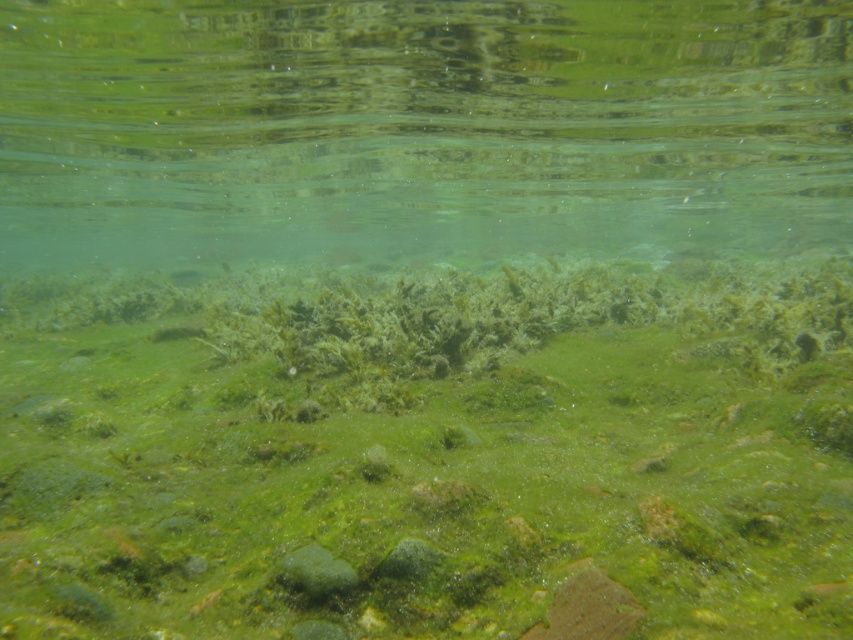
Question: Does green algae at center have a larger size compared to green translucent water at center?

Choices:
 (A) yes
 (B) no

Answer: (B)

Question: Which point is closer to the camera?

Choices:
 (A) (775, 205)
 (B) (592, 278)

Answer: (B)

Question: Among these objects, which one is nearest to the camera?

Choices:
 (A) green algae at center
 (B) green translucent water at center

Answer: (A)

Question: Is the position of green algae at center less distant than that of green translucent water at center?

Choices:
 (A) yes
 (B) no

Answer: (A)

Question: Can you confirm if green algae at center is bigger than green translucent water at center?

Choices:
 (A) no
 (B) yes

Answer: (A)